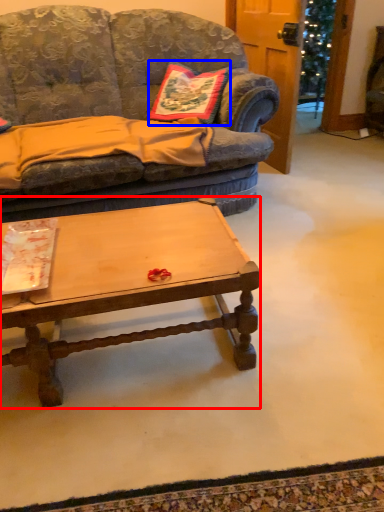
Question: Which point is closer to the camera, coffee table (highlighted by a red box) or pillow (highlighted by a blue box)?

Choices:
 (A) coffee table
 (B) pillow

Answer: (A)